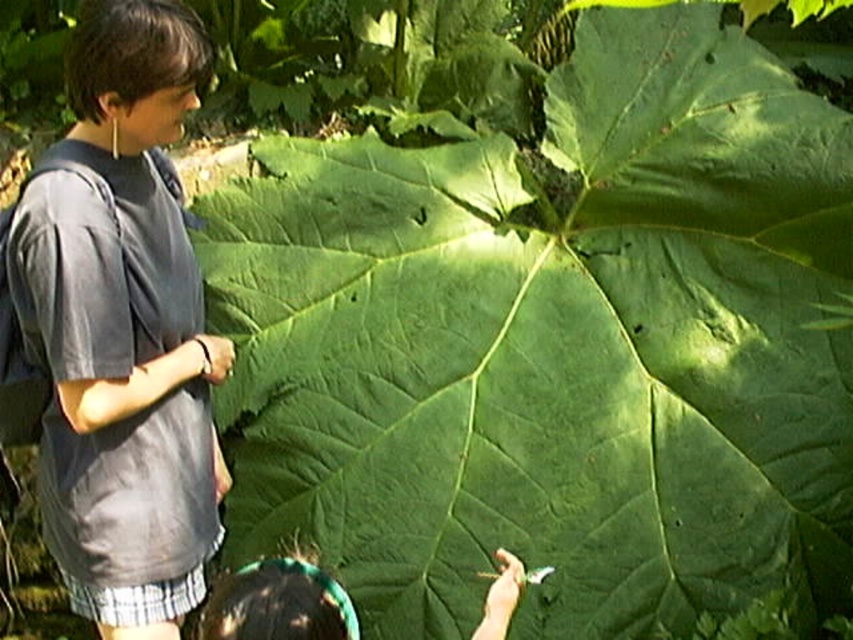
Question: Which of the following is the closest to the observer?

Choices:
 (A) dark green leaf at lower center
 (B) gray cotton shirt at left

Answer: (A)

Question: Can you confirm if gray cotton shirt at left is wider than dark green leaf at lower center?

Choices:
 (A) no
 (B) yes

Answer: (B)

Question: Which point appears closest to the camera in this image?

Choices:
 (A) (300, 621)
 (B) (126, 138)

Answer: (A)

Question: Is gray cotton shirt at left to the left of dark green leaf at lower center from the viewer's perspective?

Choices:
 (A) yes
 (B) no

Answer: (A)

Question: Is gray cotton shirt at left thinner than dark green leaf at lower center?

Choices:
 (A) no
 (B) yes

Answer: (A)